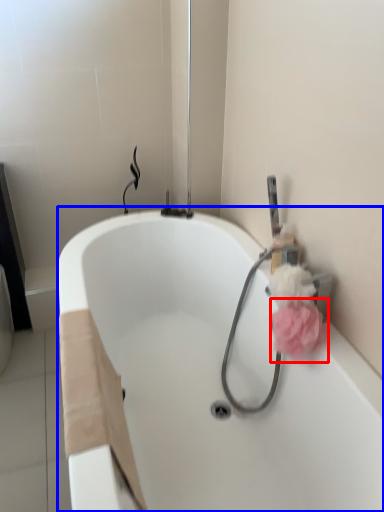
Question: Which object appears farthest to the camera in this image, flower (highlighted by a red box) or bathtub (highlighted by a blue box)?

Choices:
 (A) flower
 (B) bathtub

Answer: (A)